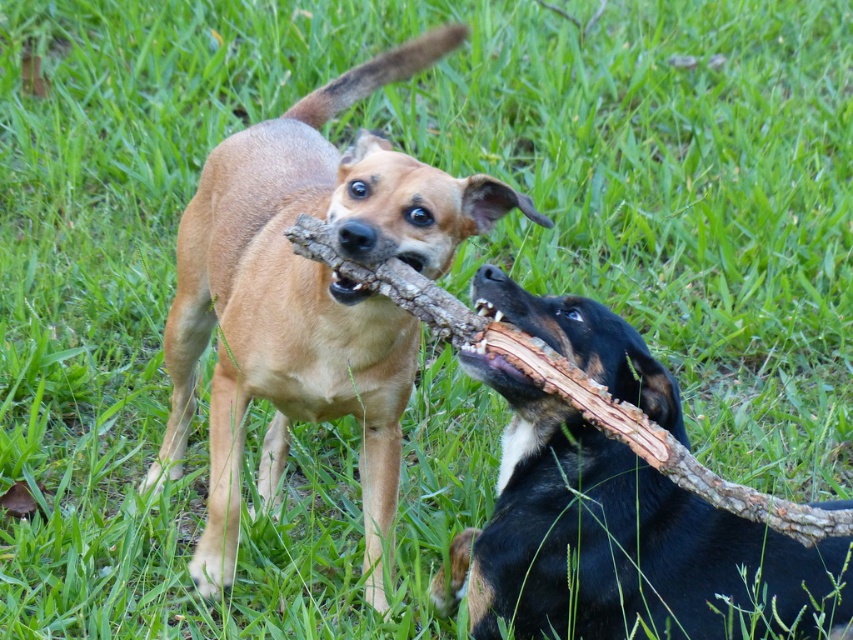
You are a dog trainer observing two dogs playing. You notice the brown fur dog at center and the black smooth dog at lower right. Which dog would you expect to have more strength based on their size? Please explain your reasoning.

The brown fur dog at center is bigger than the black smooth dog at lower right, so it likely has more strength due to its larger size.

You are standing at the point marked by the coordinates point (310, 298) in the image. Looking around, you see the brown fur dog at center and the black dog with brown markings on the right. Which dog is closer to your current position?

The point (310, 298) corresponds to the brown fur dog at center, so you are currently at the brown fur dog at center. Therefore, the brown fur dog at center is at your current position.